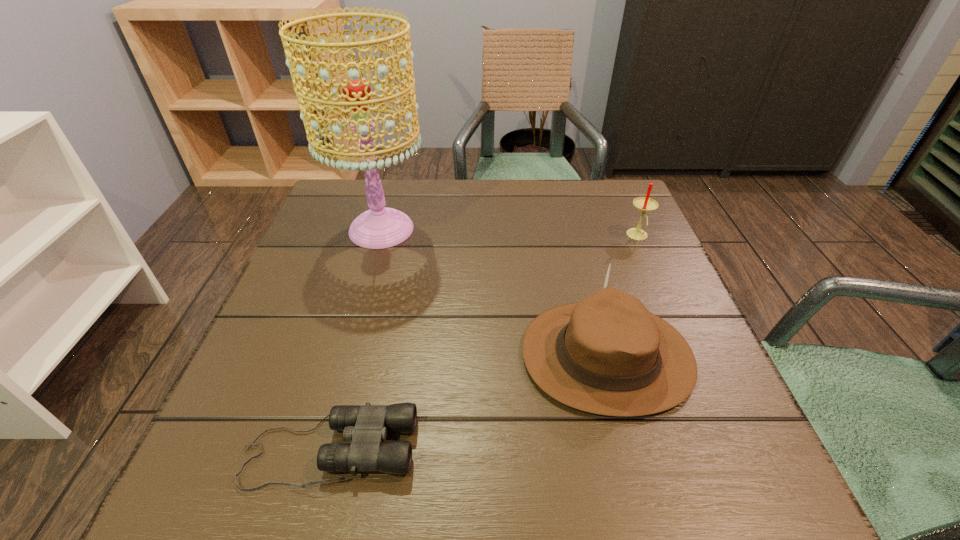
Identify the location of the tallest object. Image resolution: width=960 pixels, height=540 pixels. (380, 227).

You are a GUI agent. You are given a task and a screenshot of the screen. Output one action in this format:
    pyautogui.click(x=<x>, y=<y>)
    Task: Click on the candle
    This screenshot has height=540, width=960.
    Given the screenshot: What is the action you would take?
    pyautogui.click(x=646, y=204)

Where is `fedora`? fedora is located at coordinates (607, 354).

Image resolution: width=960 pixels, height=540 pixels. Identify the location of binoculars. (366, 426).

Find the location of a particular element. This screenshot has width=960, height=540. free space located on the front of the lampshade is located at coordinates (368, 280).

Find the location of a particular element. This screenshot has height=540, width=960. vacant point located 0.230m on the front of the candle is located at coordinates (673, 316).

The width and height of the screenshot is (960, 540). I want to click on free space located 0.250m on the feather side of the fedora, so [385, 356].

You are a GUI agent. You are given a task and a screenshot of the screen. Output one action in this format:
    pyautogui.click(x=<x>, y=<y>)
    Task: Click on the vacant area situated on the feather side of the fedora
    
    Given the screenshot: What is the action you would take?
    click(x=434, y=356)

This screenshot has width=960, height=540. In order to click on vacant space located 0.050m on the feather side of the fedora in this screenshot , I will do `click(494, 356)`.

This screenshot has height=540, width=960. What are the coordinates of `vacant area situated at the eyepiece of the shortest object` in the screenshot? It's located at (630, 450).